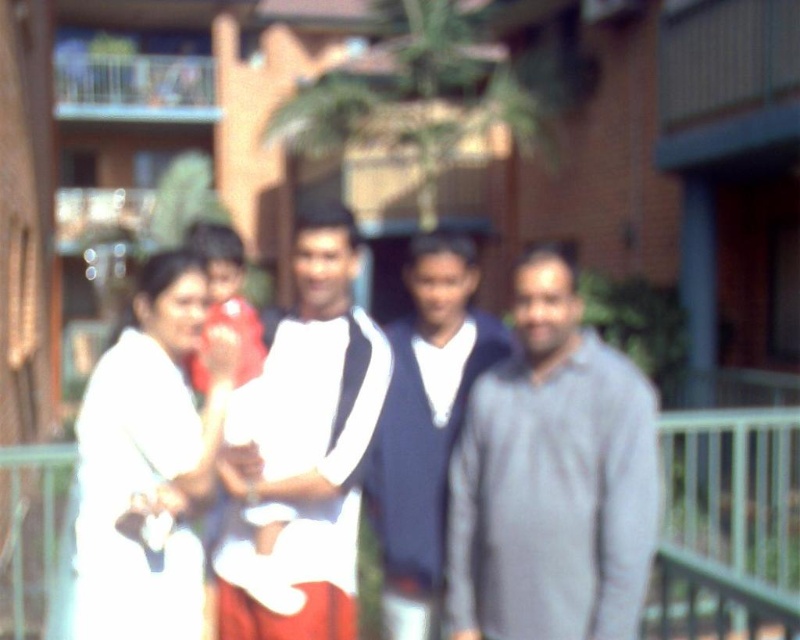
You are trying to decide which white shirt to wear for an outdoor event. You see two options in the image of the group standing in front of the building with a balcony. Which one is smaller in size between the white fabric shirt at center and the white matte shirt at center?

The white fabric shirt at center is smaller in size compared to the white matte shirt at center, as it occupies less space.

You are trying to identify two people in the image based on their clothing. You see a gray matte shirt at center and a white matte clothing at center. Which of these two has a shorter height?

The gray matte shirt at center is shorter than the white matte clothing at center.

You are standing in front of the building and notice two points marked on the ground. The first point is at coordinate point(270, 497) and the second is at point(220, 237). Which point is closer to you?

Point(270, 497) is in front of point(220, 237), so it is closer to you.